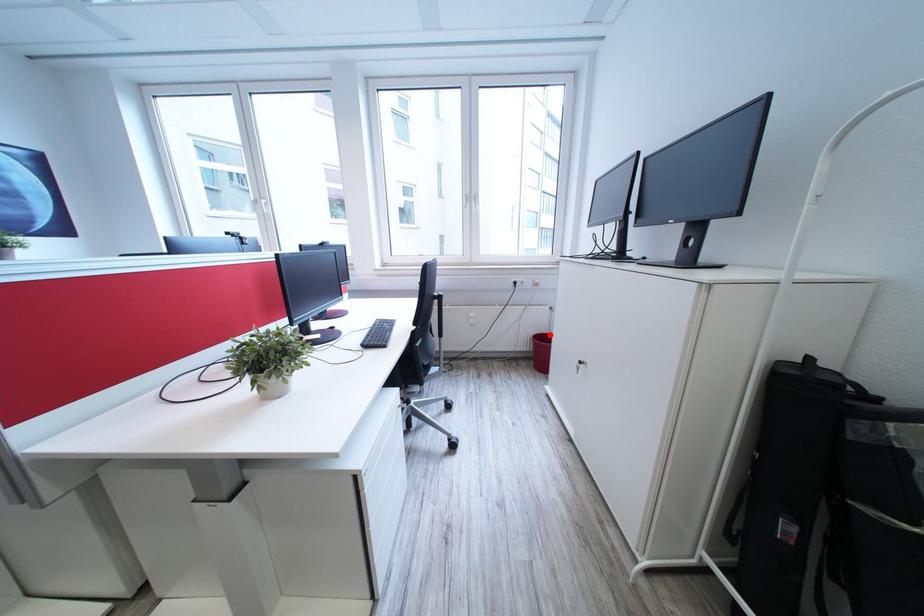
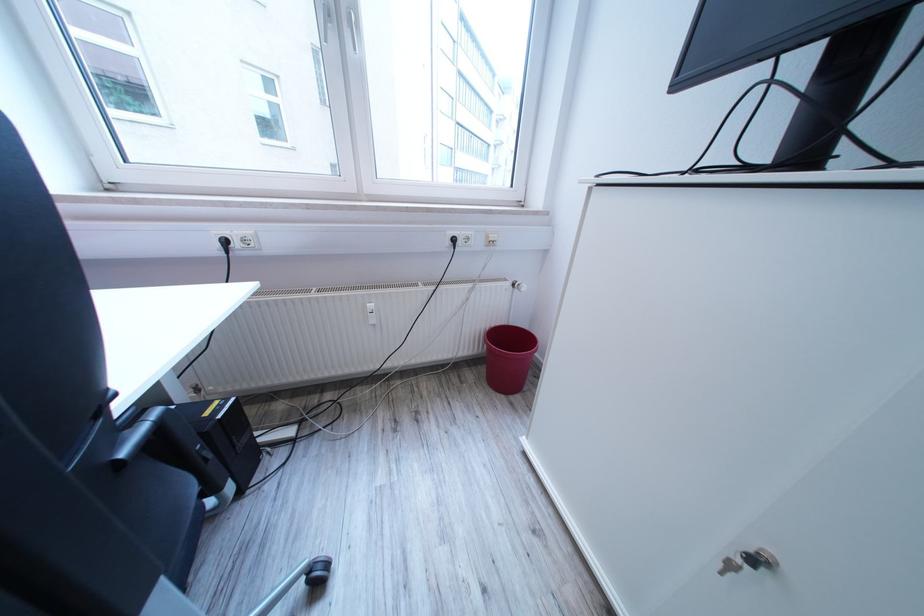
Question: I am providing you with two images of the same scene from different viewpoints. In image1, a red point is highlighted. Considering the same 3D point in image2, which of the following is correct?

Choices:
 (A) It is closer
 (B) It is farther

Answer: (B)